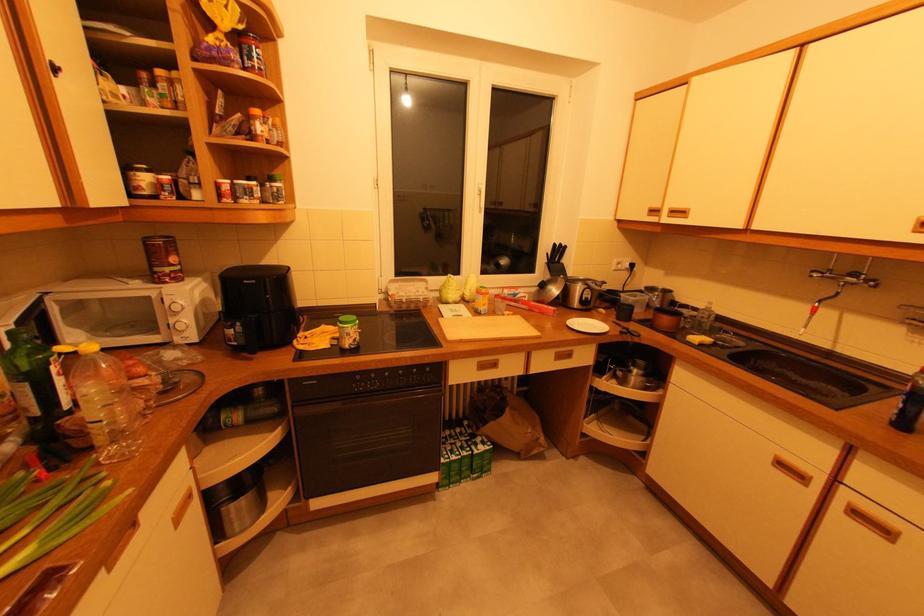
Where would you turn the white microwave dial? Please return your answer as a coordinate pair (x, y).

(181, 312)